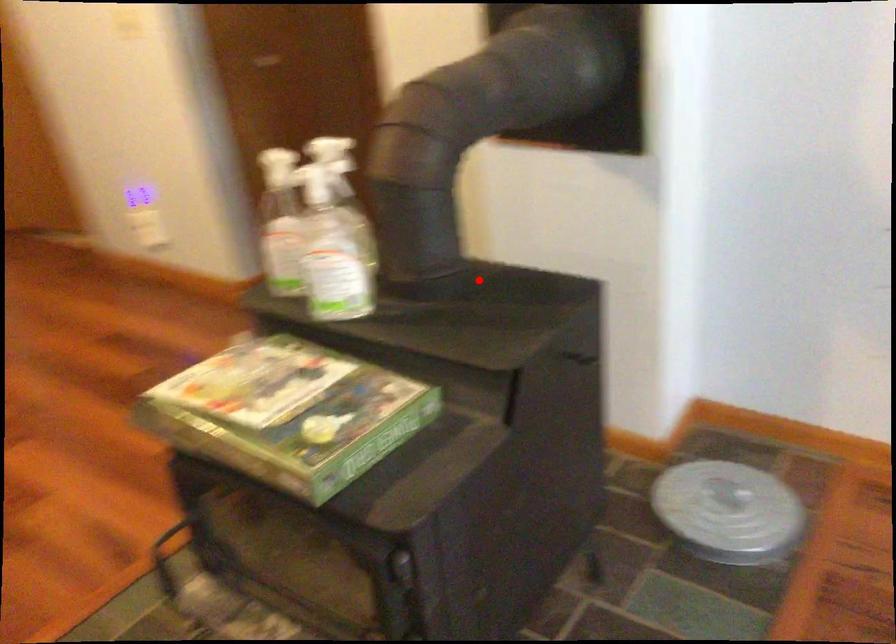
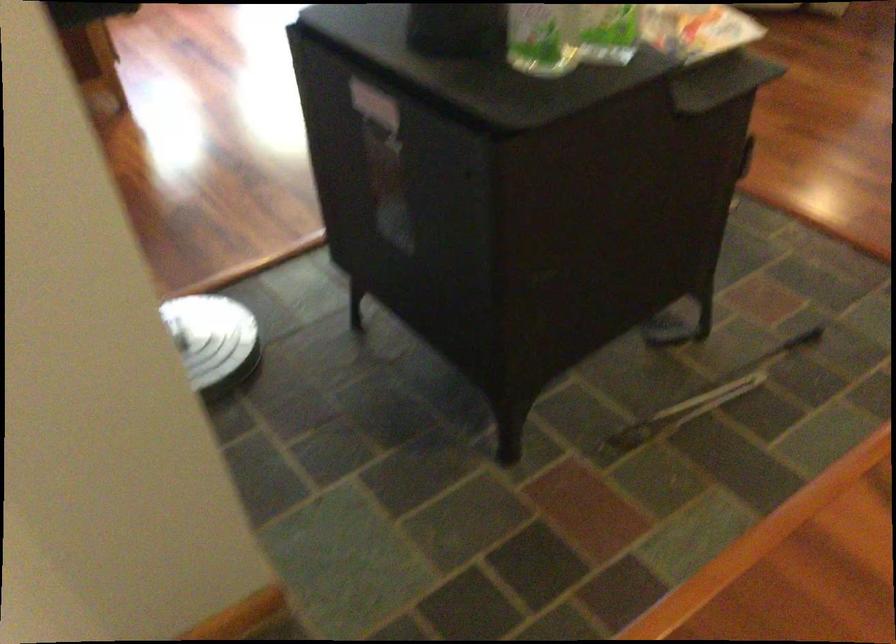
The point at the highlighted location is marked in the first image. Where is the corresponding point in the second image?

(375, 104)